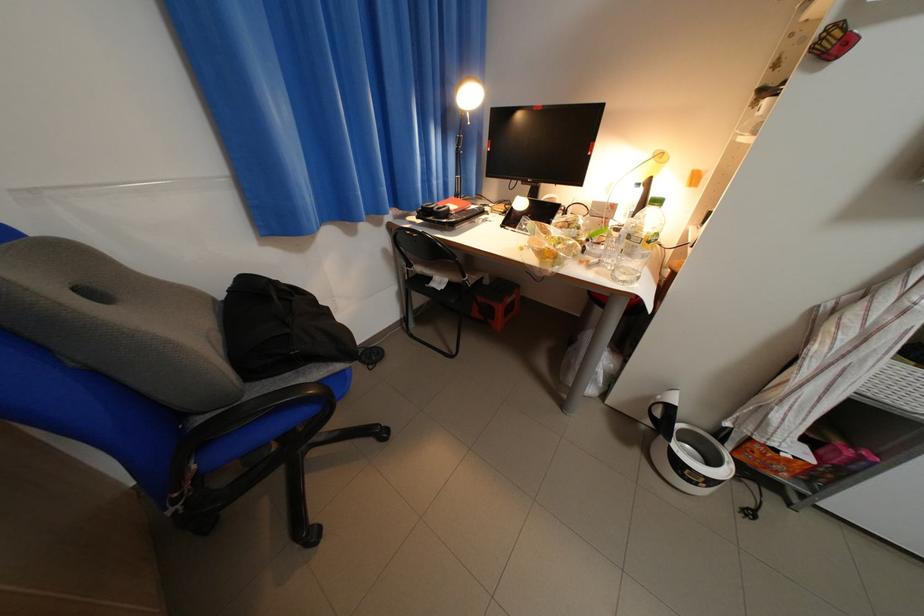
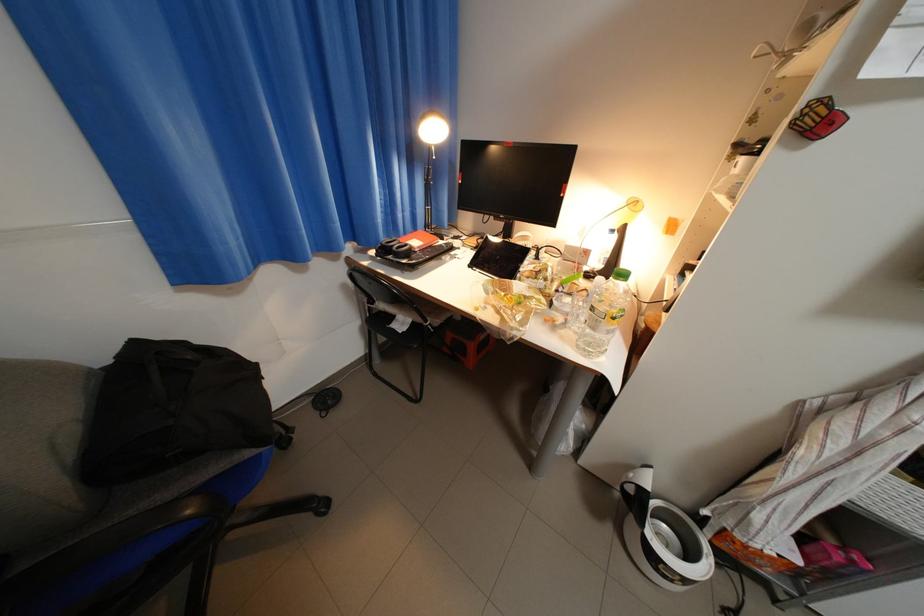
Where in the second image is the point corresponding to pixel 641 256 from the first image?

(605, 330)